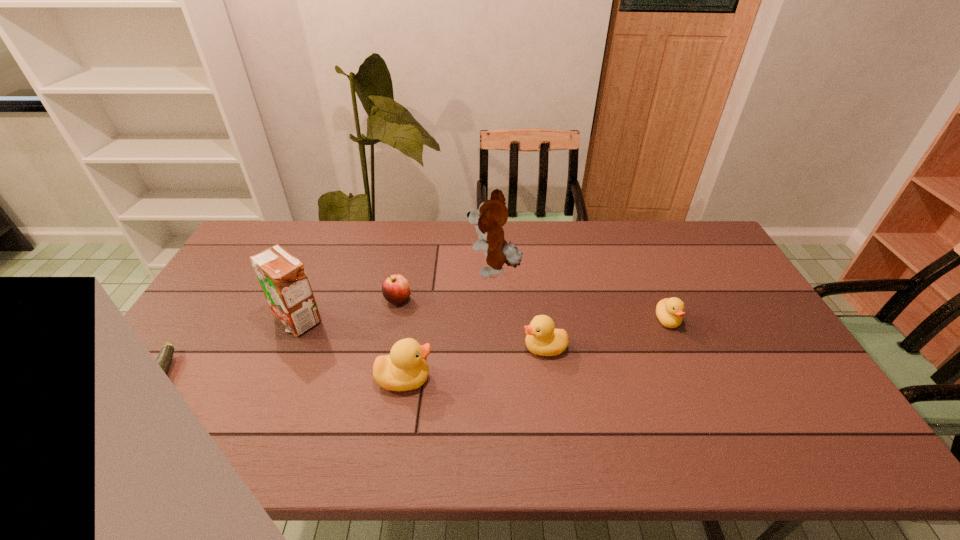
The image size is (960, 540). Identify the location of vacant space located 0.220m on the face of the puppy. (403, 271).

This screenshot has height=540, width=960. I want to click on vacant space located 0.320m on the face of the puppy, so click(x=373, y=271).

Locate an element on the screen. free region located 0.370m on the front of the apple is located at coordinates (374, 417).

Locate an element on the screen. The height and width of the screenshot is (540, 960). object that is at the far edge is located at coordinates (492, 214).

This screenshot has width=960, height=540. What are the coordinates of `duckling that is at the near edge` in the screenshot? It's located at (405, 369).

You are a GUI agent. You are given a task and a screenshot of the screen. Output one action in this format:
    pyautogui.click(x=<x>, y=<y>)
    Task: Click on the zucchini present at the near edge
    This screenshot has height=540, width=960.
    Given the screenshot: What is the action you would take?
    pyautogui.click(x=164, y=358)

This screenshot has width=960, height=540. Find the location of `object present at the left edge`. object present at the left edge is located at coordinates (164, 358).

At what (x,y) coordinates should I click in order to perform the action: click on object situated at the near left corner. Please return your answer as a coordinate pair (x, y). Image resolution: width=960 pixels, height=540 pixels. Looking at the image, I should click on (164, 358).

Where is `free space at the far edge of the desktop`? The image size is (960, 540). free space at the far edge of the desktop is located at coordinates (385, 221).

Locate an element on the screen. The height and width of the screenshot is (540, 960). vacant space at the near edge of the desktop is located at coordinates (246, 411).